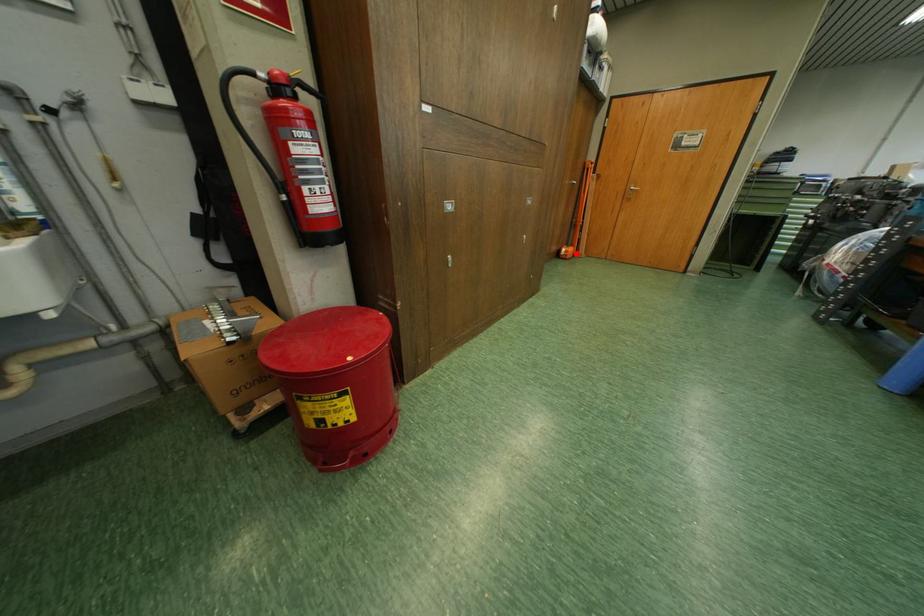
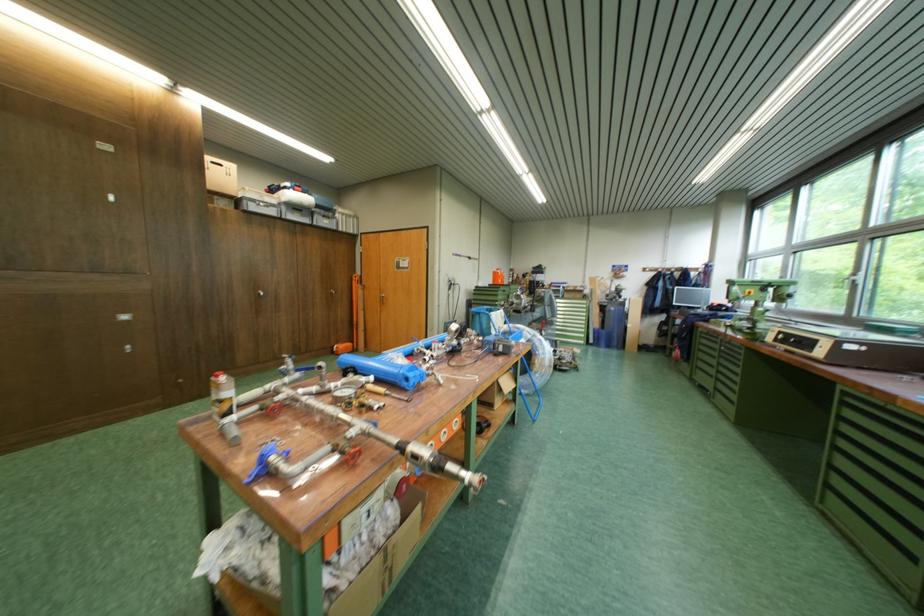
Question: I am providing you with two images of the same scene from different viewpoints. A red point is shown in image1. For the corresponding object point in image2, is it positioned nearer or farther from the camera?

Choices:
 (A) Nearer
 (B) Farther

Answer: (B)